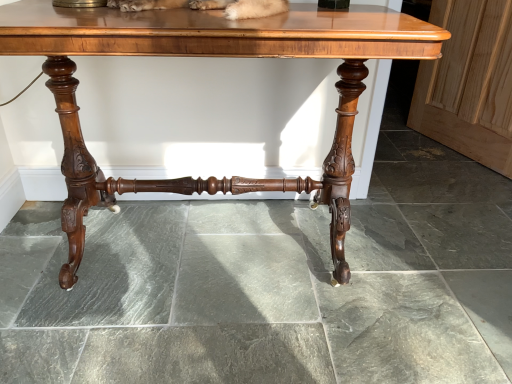
The width and height of the screenshot is (512, 384). I want to click on vacant area located to the right-hand side of polished wood table at center, so click(428, 261).